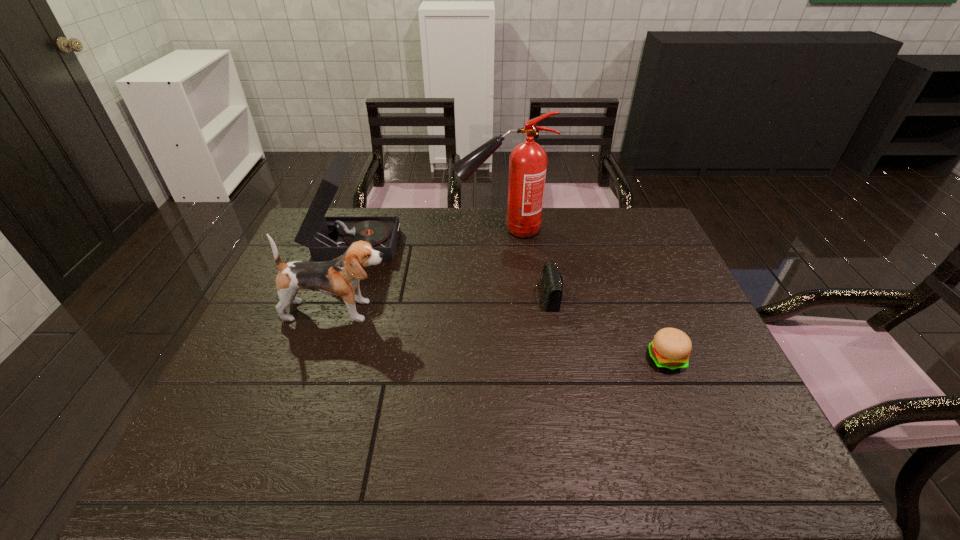
Identify the location of vacant area that lies between the puppy and the clutch bag. The image size is (960, 540). (443, 303).

Identify the location of free space that is in between the hamburger and the puppy. The width and height of the screenshot is (960, 540). (502, 335).

This screenshot has height=540, width=960. Identify the location of free space between the phonograph_record and the clutch bag. (450, 268).

Locate an element on the screen. Image resolution: width=960 pixels, height=540 pixels. empty space that is in between the clutch bag and the tallest object is located at coordinates (524, 262).

At what (x,y) coordinates should I click in order to perform the action: click on free space between the fire extinguisher and the hamburger. Please return your answer as a coordinate pair (x, y). The height and width of the screenshot is (540, 960). Looking at the image, I should click on (584, 294).

Find the location of a particular element. This screenshot has height=540, width=960. the fourth closest object to the puppy is located at coordinates (670, 349).

Select which object is the fourth closest to the phonograph_record. Please provide its 2D coordinates. Your answer should be formatted as a tuple, i.e. [(x, y)], where the tuple contains the x and y coordinates of a point satisfying the conditions above.

[(670, 349)]

In order to click on vacant point that satisfies the following two spatial constraints: 1. on the front flap of the clutch bag; 2. on the back side of the rightmost object in this screenshot , I will do `click(558, 359)`.

Where is `vacant point that satisfies the following two spatial constraints: 1. on the front-facing side of the hamburger; 2. on the right side of the phonograph_record`? This screenshot has width=960, height=540. vacant point that satisfies the following two spatial constraints: 1. on the front-facing side of the hamburger; 2. on the right side of the phonograph_record is located at coordinates pyautogui.click(x=312, y=359).

Locate an element on the screen. free point that satisfies the following two spatial constraints: 1. on the back side of the nearest object; 2. at the face of the puppy is located at coordinates (647, 311).